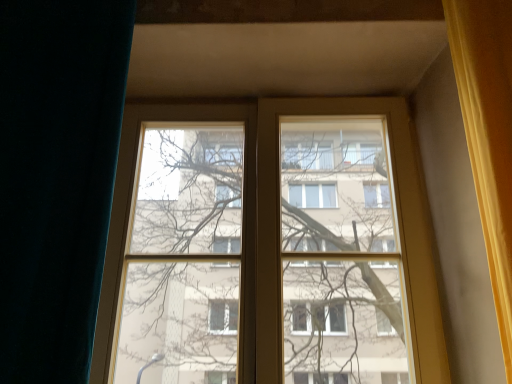
The image size is (512, 384). What do you see at coordinates (268, 246) in the screenshot?
I see `transparent glass window at center` at bounding box center [268, 246].

What is the approximate width of transparent glass window at center?

transparent glass window at center is 4.60 inches wide.

In order to click on transparent glass window at center in this screenshot , I will do `click(268, 246)`.

The image size is (512, 384). Identify the location of transparent glass window at center. (268, 246).